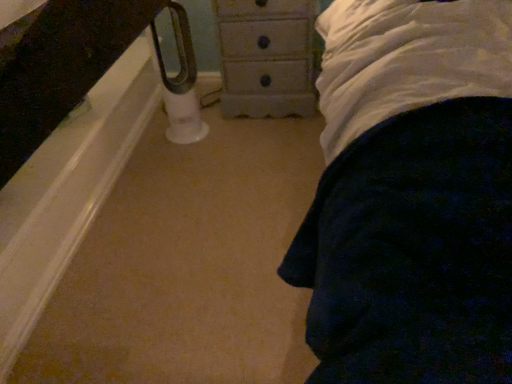
Identify the location of free region on the left part of white plastic towel bar at lower left. (151, 142).